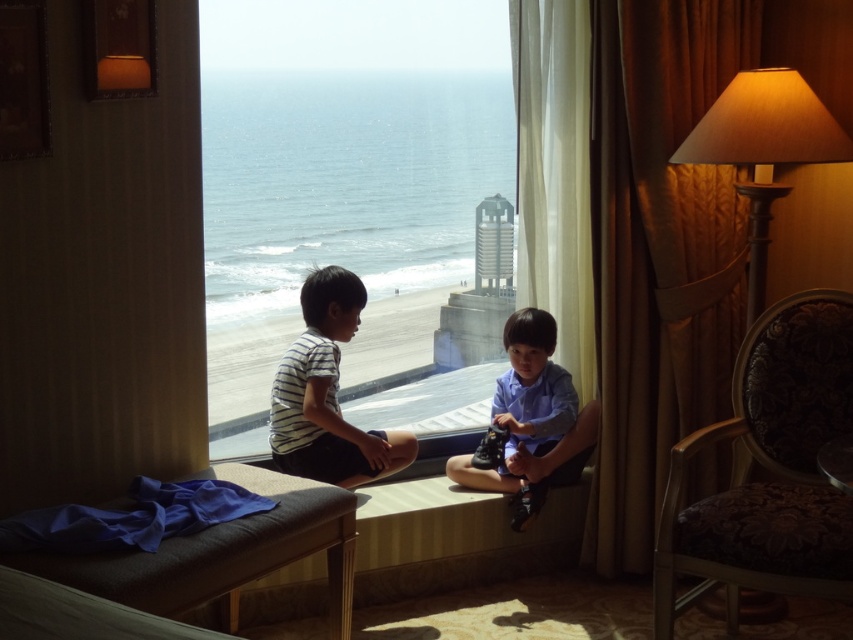
Question: Which point appears farthest from the camera in this image?

Choices:
 (A) (769, 496)
 (B) (247, 42)

Answer: (B)

Question: Which point is closer to the camera?

Choices:
 (A) matte beige lampshade at right
 (B) transparent glass window at center

Answer: (A)

Question: Which is farther from the blue smooth shirt at center?

Choices:
 (A) blue fabric at lower left
 (B) matte beige lampshade at right
 (C) dark brown upholstered armchair at right
 (D) transparent glass window at center

Answer: (A)

Question: Where is striped cotton shirt at center located in relation to matte beige lampshade at right in the image?

Choices:
 (A) right
 (B) left

Answer: (B)

Question: Can you confirm if blue fabric at lower left is positioned to the right of matte beige lampshade at right?

Choices:
 (A) no
 (B) yes

Answer: (A)

Question: Is blue fabric at lower left above striped cotton shirt at center?

Choices:
 (A) yes
 (B) no

Answer: (B)